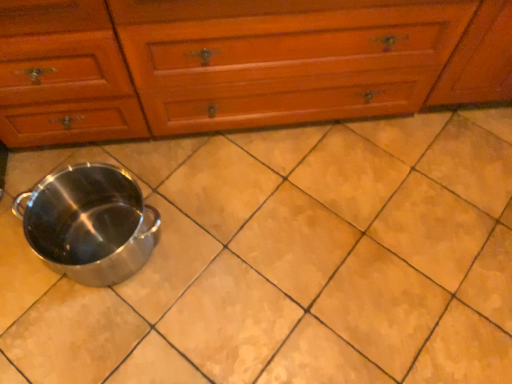
Identify the location of free space underneath satin silver crock pot at lower left (from a real-world perspective). Image resolution: width=512 pixels, height=384 pixels. (96, 248).